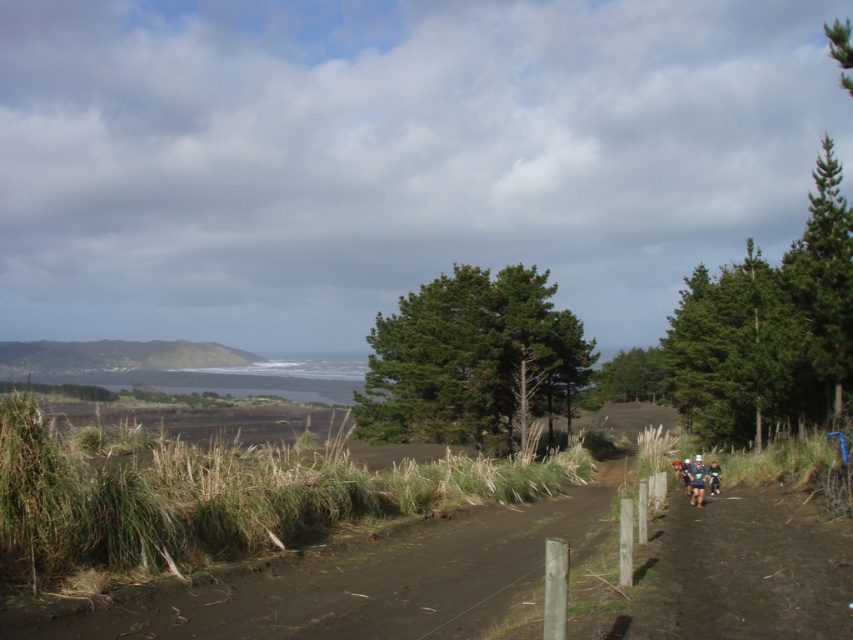
Question: Which point is closer to the camera taking this photo?

Choices:
 (A) (701, 490)
 (B) (102, 346)

Answer: (A)

Question: Does brown sandy hill at left have a larger size compared to dark green jersey at center-right?

Choices:
 (A) no
 (B) yes

Answer: (B)

Question: Does brown sandy hill at left appear on the right side of dark green jersey at center-right?

Choices:
 (A) yes
 (B) no

Answer: (B)

Question: Is brown sandy hill at left smaller than dark green jersey at center-right?

Choices:
 (A) no
 (B) yes

Answer: (A)